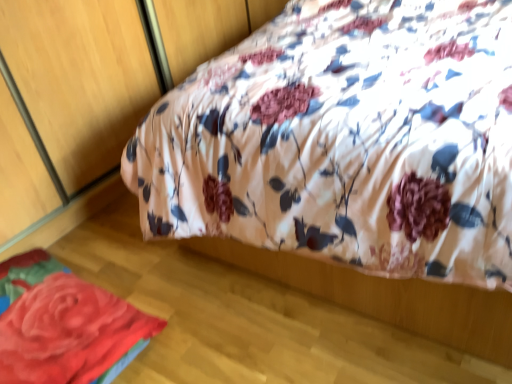
Question: Is fluffy fabric rose at lower left bigger than floral fabric bed at upper center?

Choices:
 (A) yes
 (B) no

Answer: (B)

Question: Is the depth of fluffy fabric rose at lower left greater than that of floral fabric bed at upper center?

Choices:
 (A) yes
 (B) no

Answer: (A)

Question: Can you confirm if fluffy fabric rose at lower left is thinner than floral fabric bed at upper center?

Choices:
 (A) no
 (B) yes

Answer: (B)

Question: Considering the relative sizes of fluffy fabric rose at lower left and floral fabric bed at upper center in the image provided, is fluffy fabric rose at lower left taller than floral fabric bed at upper center?

Choices:
 (A) no
 (B) yes

Answer: (A)

Question: Is fluffy fabric rose at lower left smaller than floral fabric bed at upper center?

Choices:
 (A) yes
 (B) no

Answer: (A)

Question: From the image's perspective, does fluffy fabric rose at lower left appear lower than floral fabric bed at upper center?

Choices:
 (A) yes
 (B) no

Answer: (A)

Question: Does floral fabric bed at upper center come in front of fluffy fabric rose at lower left?

Choices:
 (A) no
 (B) yes

Answer: (B)

Question: Is floral fabric bed at upper center far away from fluffy fabric rose at lower left?

Choices:
 (A) yes
 (B) no

Answer: (B)

Question: Is the depth of floral fabric bed at upper center greater than that of fluffy fabric rose at lower left?

Choices:
 (A) yes
 (B) no

Answer: (B)

Question: Can you confirm if floral fabric bed at upper center is bigger than fluffy fabric rose at lower left?

Choices:
 (A) no
 (B) yes

Answer: (B)

Question: Is floral fabric bed at upper center not inside fluffy fabric rose at lower left?

Choices:
 (A) yes
 (B) no

Answer: (A)

Question: Can you confirm if floral fabric bed at upper center is shorter than fluffy fabric rose at lower left?

Choices:
 (A) no
 (B) yes

Answer: (A)

Question: Is fluffy fabric rose at lower left wider or thinner than floral fabric bed at upper center?

Choices:
 (A) thin
 (B) wide

Answer: (A)